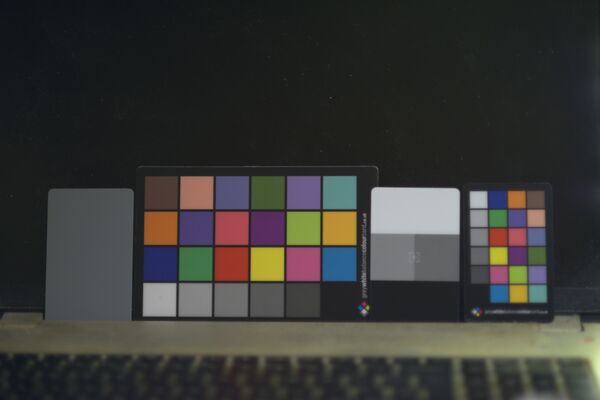
Identify the location of keyboard. (200, 383).